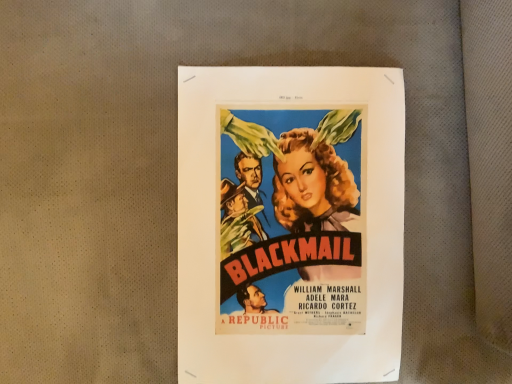
At what (x,y) coordinates should I click in order to perform the action: click on vacant area on top of vibrant paper poster at center (from a real-world perspective). Please return your answer as a coordinate pair (x, y). Looking at the image, I should click on (287, 157).